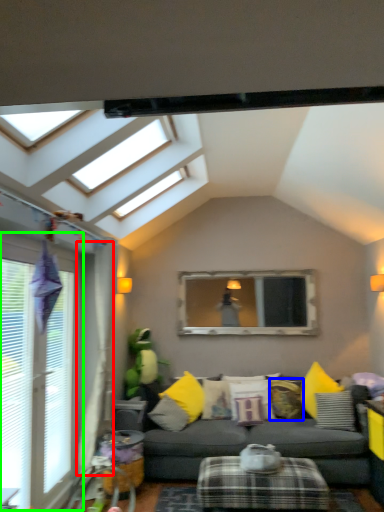
Question: Considering the real-world distances, which object is farthest from curtain (highlighted by a red box)? pillow (highlighted by a blue box) or window (highlighted by a green box)?

Choices:
 (A) pillow
 (B) window

Answer: (A)